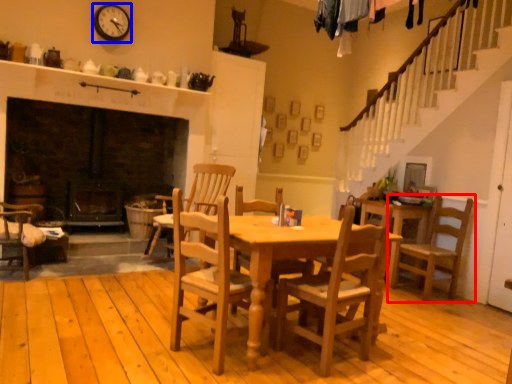
Question: Which point is further to the camera, chair (highlighted by a red box) or clock (highlighted by a blue box)?

Choices:
 (A) chair
 (B) clock

Answer: (B)